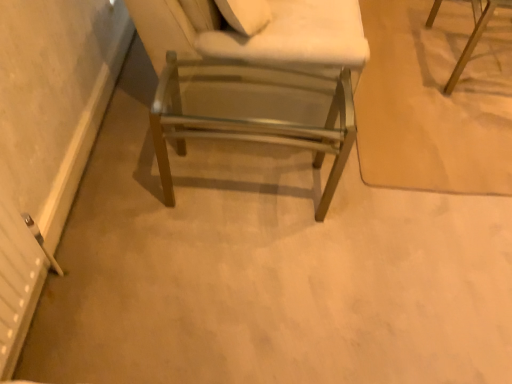
The width and height of the screenshot is (512, 384). I want to click on metallic silver chair at center, the second chair viewed from the top, so click(x=253, y=112).

This screenshot has height=384, width=512. What do you see at coordinates (253, 112) in the screenshot?
I see `metallic silver chair at center, marked as the first chair in a left-to-right arrangement` at bounding box center [253, 112].

The height and width of the screenshot is (384, 512). Describe the element at coordinates (474, 36) in the screenshot. I see `wooden chair at upper right, the 1th chair positioned from the back` at that location.

Identify the location of wooden chair at upper right, which is the 1th chair in top-to-bottom order. The width and height of the screenshot is (512, 384). (474, 36).

What is the approximate width of wooden chair at upper right, the 1th chair positioned from the back?

It is 65.63 centimeters.

Find the location of a particular element. This screenshot has width=512, height=384. metallic silver chair at center, the first chair in the front-to-back sequence is located at coordinates (253, 112).

Would you say wooden chair at upper right, the first chair viewed from the right, is to the left or to the right of metallic silver chair at center, placed as the second chair when sorted from back to front, in the picture?

wooden chair at upper right, the first chair viewed from the right, is positioned on metallic silver chair at center, placed as the second chair when sorted from back to front,'s right side.

Which object is more forward, wooden chair at upper right, placed as the second chair when sorted from front to back, or metallic silver chair at center, positioned as the second chair in right-to-left order?

metallic silver chair at center, positioned as the second chair in right-to-left order, is more forward.

Which is closer, (x=472, y=37) or (x=260, y=103)?

Clearly, point (x=472, y=37) is more distant from the camera than point (x=260, y=103).

From the image's perspective, between wooden chair at upper right, which is the 1th chair in top-to-bottom order, and metallic silver chair at center, positioned as the second chair in right-to-left order, which one is located above?

From the image's view, wooden chair at upper right, which is the 1th chair in top-to-bottom order, is above.

From a real-world perspective, is wooden chair at upper right, the first chair viewed from the right, located beneath metallic silver chair at center, marked as the first chair in a left-to-right arrangement?

Actually, wooden chair at upper right, the first chair viewed from the right, is physically above metallic silver chair at center, marked as the first chair in a left-to-right arrangement, in the real world.

Is wooden chair at upper right, which is the 1th chair in top-to-bottom order, wider or thinner than metallic silver chair at center, positioned as the second chair in right-to-left order?

In the image, wooden chair at upper right, which is the 1th chair in top-to-bottom order, appears to be more narrow than metallic silver chair at center, positioned as the second chair in right-to-left order.

Is wooden chair at upper right, the 1th chair positioned from the back, taller than metallic silver chair at center, marked as the first chair in a left-to-right arrangement?

Correct, wooden chair at upper right, the 1th chair positioned from the back, is much taller as metallic silver chair at center, marked as the first chair in a left-to-right arrangement.

From the picture: In terms of size, does wooden chair at upper right, the 1th chair positioned from the back, appear bigger or smaller than metallic silver chair at center, the second chair viewed from the top?

Considering their sizes, wooden chair at upper right, the 1th chair positioned from the back, takes up more space than metallic silver chair at center, the second chair viewed from the top.

Is wooden chair at upper right, placed as the second chair when sorted from front to back, inside the boundaries of metallic silver chair at center, positioned as the second chair in right-to-left order, or outside?

wooden chair at upper right, placed as the second chair when sorted from front to back, exists outside the volume of metallic silver chair at center, positioned as the second chair in right-to-left order.

Looking at this image, is there a large distance between wooden chair at upper right, the 1th chair positioned from the back, and metallic silver chair at center, the second chair viewed from the top?

Indeed, wooden chair at upper right, the 1th chair positioned from the back, is not near metallic silver chair at center, the second chair viewed from the top.

Is metallic silver chair at center, positioned as the second chair in right-to-left order, at the back of wooden chair at upper right, the 1th chair positioned from the back?

No, metallic silver chair at center, positioned as the second chair in right-to-left order, is not at the back of wooden chair at upper right, the 1th chair positioned from the back.

Could you measure the distance between wooden chair at upper right, the 2th chair in the left-to-right sequence, and metallic silver chair at center, the first chair in the front-to-back sequence?

wooden chair at upper right, the 2th chair in the left-to-right sequence, and metallic silver chair at center, the first chair in the front-to-back sequence, are 1.04 meters apart.

In order to click on chair below the wooden chair at upper right, placed as the second chair when sorted from front to back (from the image's perspective) in this screenshot , I will do `click(253, 112)`.

Does metallic silver chair at center, placed as the second chair when sorted from back to front, appear on the left side of wooden chair at upper right, which is the 1th chair in top-to-bottom order?

Yes, metallic silver chair at center, placed as the second chair when sorted from back to front, is to the left of wooden chair at upper right, which is the 1th chair in top-to-bottom order.

Is metallic silver chair at center, the second chair viewed from the top, closer to the viewer compared to wooden chair at upper right, which is the 1th chair in top-to-bottom order?

Yes, it is in front of wooden chair at upper right, which is the 1th chair in top-to-bottom order.

Is point (289, 96) closer to viewer compared to point (489, 13)?

Yes, it is in front of point (489, 13).

From the image's perspective, between metallic silver chair at center, the first chair in the front-to-back sequence, and wooden chair at upper right, the first chair viewed from the right, who is located below?

metallic silver chair at center, the first chair in the front-to-back sequence.

From a real-world perspective, is metallic silver chair at center, the second chair viewed from the top, under wooden chair at upper right, the 1th chair positioned from the back?

Correct, in the physical world, metallic silver chair at center, the second chair viewed from the top, is lower than wooden chair at upper right, the 1th chair positioned from the back.

Which of these two, metallic silver chair at center, the first chair in the front-to-back sequence, or wooden chair at upper right, the first chair viewed from the right, is wider?

Wider between the two is metallic silver chair at center, the first chair in the front-to-back sequence.

Which of these two, metallic silver chair at center, placed as the second chair when sorted from back to front, or wooden chair at upper right, placed as the second chair when sorted from front to back, stands shorter?

metallic silver chair at center, placed as the second chair when sorted from back to front.

Based on their sizes in the image, would you say metallic silver chair at center, marked as the first chair in a left-to-right arrangement, is bigger or smaller than wooden chair at upper right, the 2th chair in the left-to-right sequence?

Considering their sizes, metallic silver chair at center, marked as the first chair in a left-to-right arrangement, takes up less space than wooden chair at upper right, the 2th chair in the left-to-right sequence.

Is metallic silver chair at center, marked as the first chair in a left-to-right arrangement, outside of wooden chair at upper right, the first chair viewed from the right?

Absolutely, metallic silver chair at center, marked as the first chair in a left-to-right arrangement, is external to wooden chair at upper right, the first chair viewed from the right.

Based on the photo, is metallic silver chair at center, the second chair viewed from the top, beside wooden chair at upper right, the first chair viewed from the right?

They are not placed beside each other.

Is metallic silver chair at center, the first chair in the front-to-back sequence, positioned with its back to wooden chair at upper right, placed as the second chair when sorted from front to back?

metallic silver chair at center, the first chair in the front-to-back sequence, does not have its back to wooden chair at upper right, placed as the second chair when sorted from front to back.

Can you tell me how much metallic silver chair at center, marked as the first chair in a left-to-right arrangement, and wooden chair at upper right, the first chair viewed from the right, differ in facing direction?

The facing directions of metallic silver chair at center, marked as the first chair in a left-to-right arrangement, and wooden chair at upper right, the first chair viewed from the right, are 93 degrees apart.

What are the coordinates of `chair on the right of metallic silver chair at center, positioned as the second chair in right-to-left order` in the screenshot? It's located at (474, 36).

This screenshot has height=384, width=512. Identify the location of chair located on the left of wooden chair at upper right, the second chair ordered from the bottom. (253, 112).

The image size is (512, 384). I want to click on chair in front of the wooden chair at upper right, the first chair viewed from the right, so click(x=253, y=112).